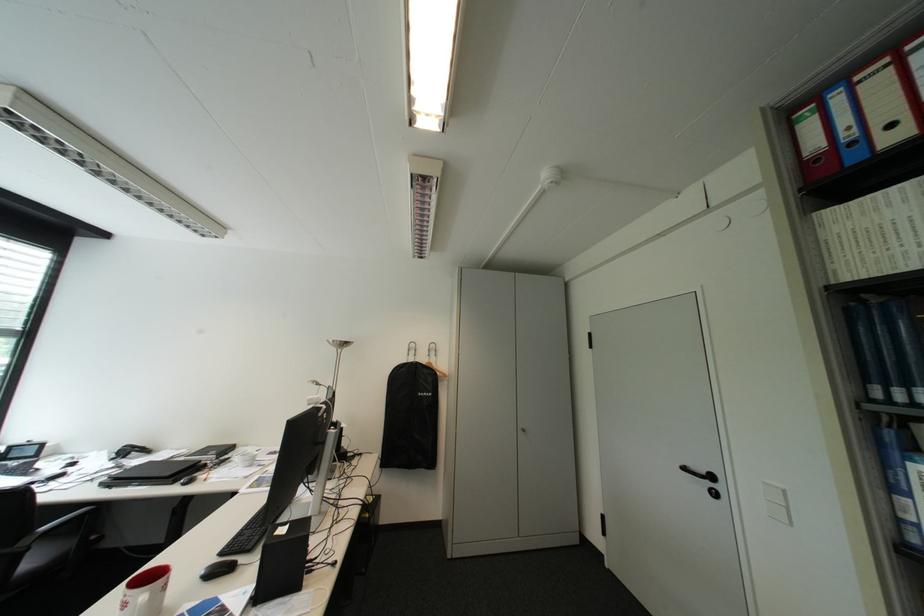
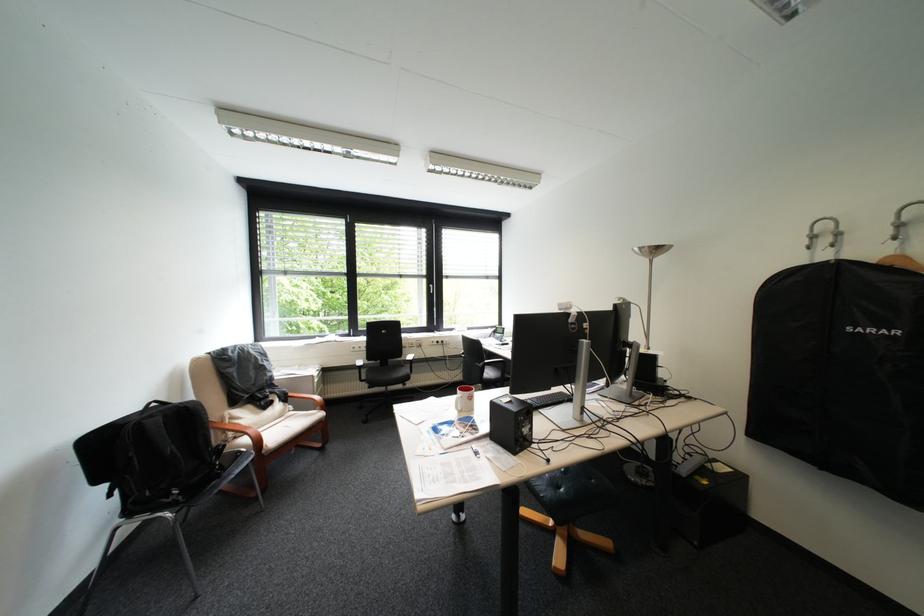
The point at (436,394) is marked in the first image. Where is the corresponding point in the second image?

(883, 331)